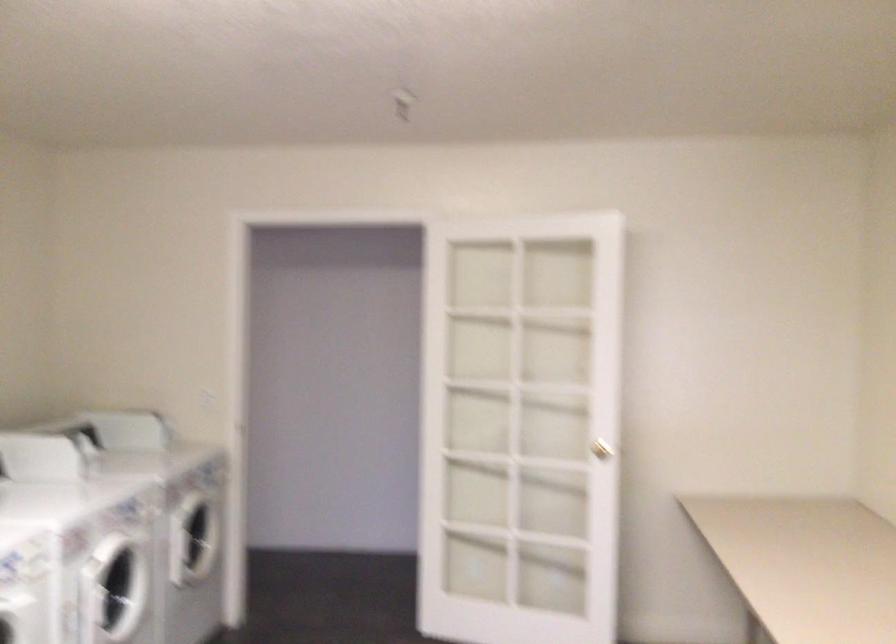
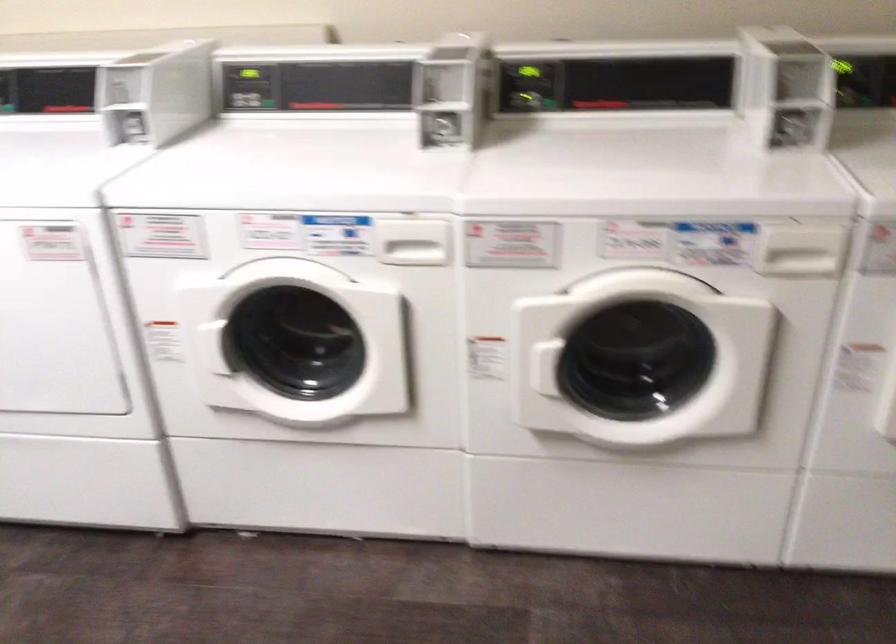
In the second image, find the point that corresponds to point (156, 507) in the first image.

(800, 251)